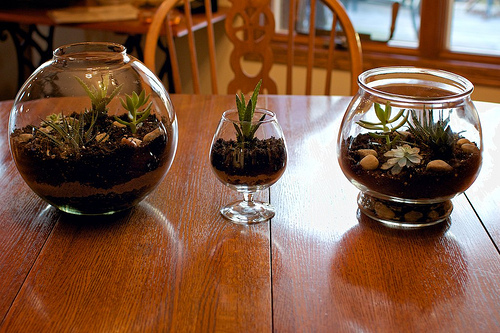
You are a GUI agent. You are given a task and a screenshot of the screen. Output one action in this format:
    pyautogui.click(x=<x>, y=<y>)
    Task: Click on the chair back
    The height and width of the screenshot is (333, 500).
    Given the screenshot: What is the action you would take?
    pyautogui.click(x=256, y=47)